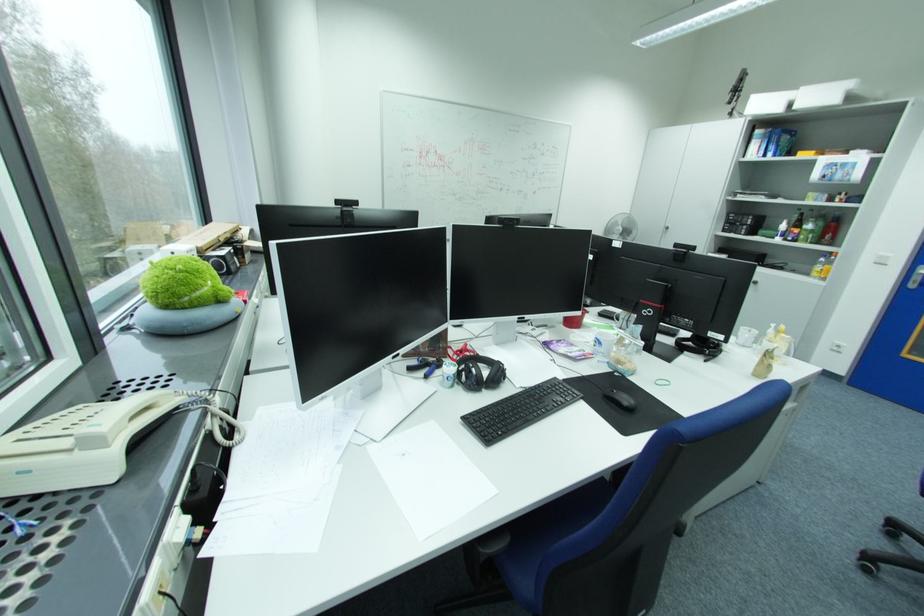
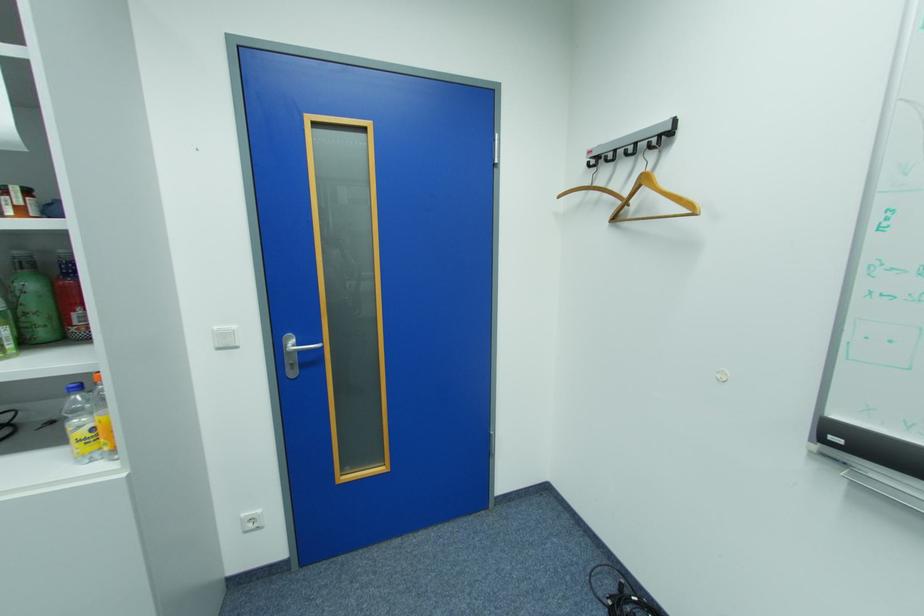
Find the pixel in the second image that matches [831,225] in the first image.

(41, 286)